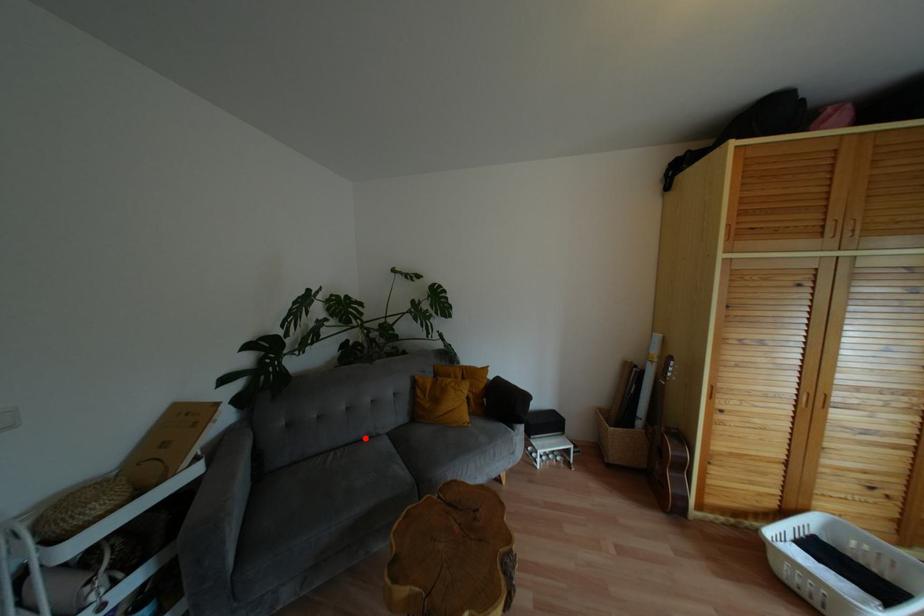
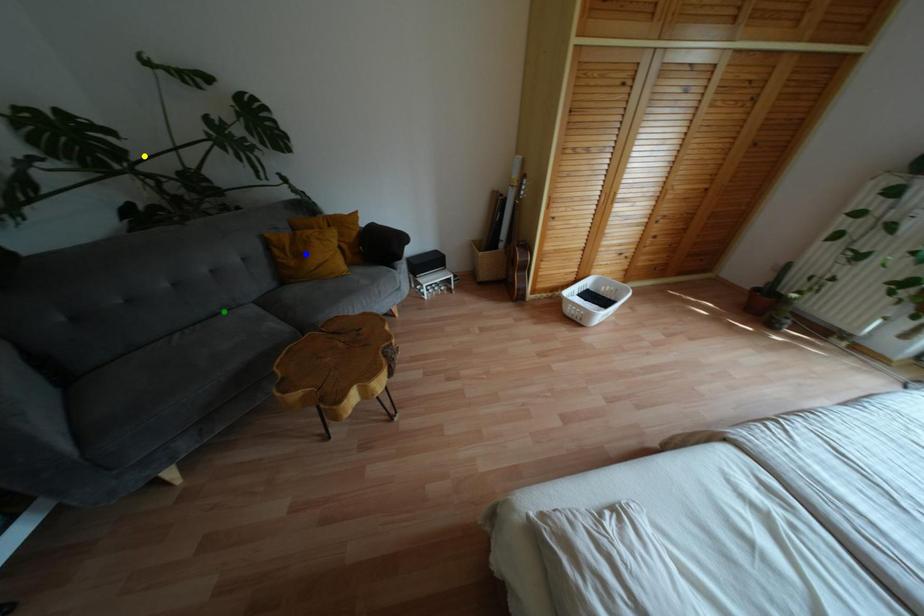
Question: I am providing you with two images of the same scene from different viewpoints. A red point is marked on the first image. You are given multiple points on the second image. Which point in image 2 is actually the same real-world point as the red point in image 1?

Choices:
 (A) yellow point
 (B) blue point
 (C) green point

Answer: (C)